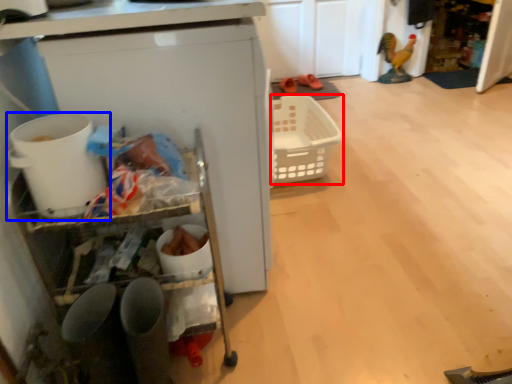
Question: Which object is closer to the camera taking this photo, basket (highlighted by a red box) or appliance (highlighted by a blue box)?

Choices:
 (A) basket
 (B) appliance

Answer: (B)